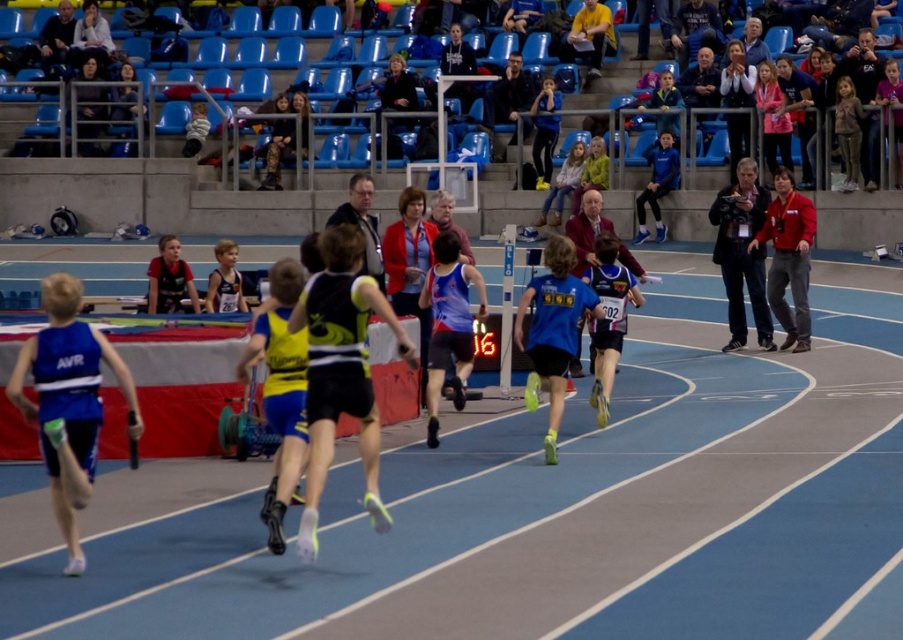
You are a photographer positioned at the starting line of the indoor track and field event. You want to capture a closeup shot of the black matte running suit at center. Given that your camera has a minimum focusing distance of 5 meters, will you be able to take the photo without moving closer?

The black matte running suit at center is 8.85 meters away from the viewer. Since the camera can focus as close as 5 meters, you can take the photo without moving closer because the distance is within the camera